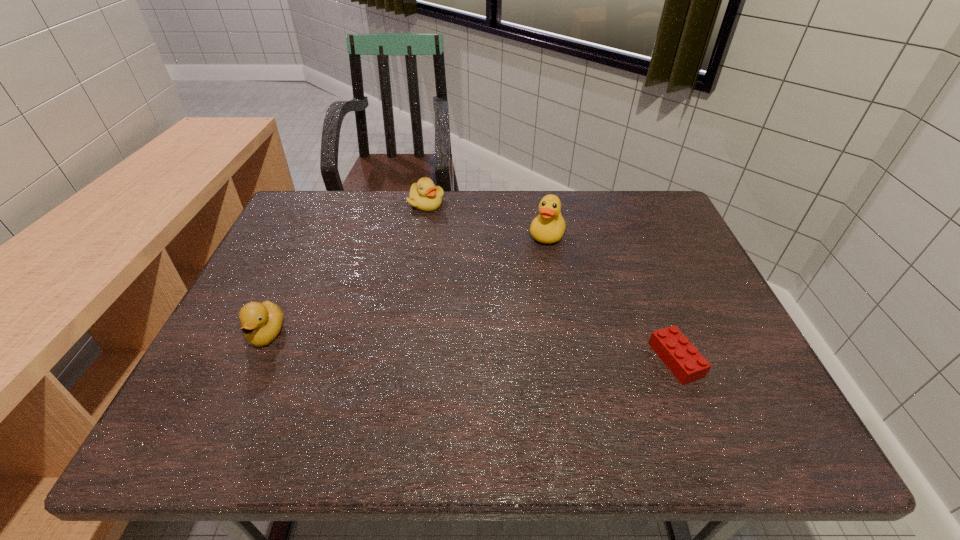
Find the location of `vacant region that satisfies the following two spatial constraints: 1. on the face of the leftmost object; 2. on the right side of the Lego`. vacant region that satisfies the following two spatial constraints: 1. on the face of the leftmost object; 2. on the right side of the Lego is located at coordinates (255, 360).

Identify the location of blank space that satisfies the following two spatial constraints: 1. on the face of the rightmost object; 2. on the right side of the left duckling. (255, 360).